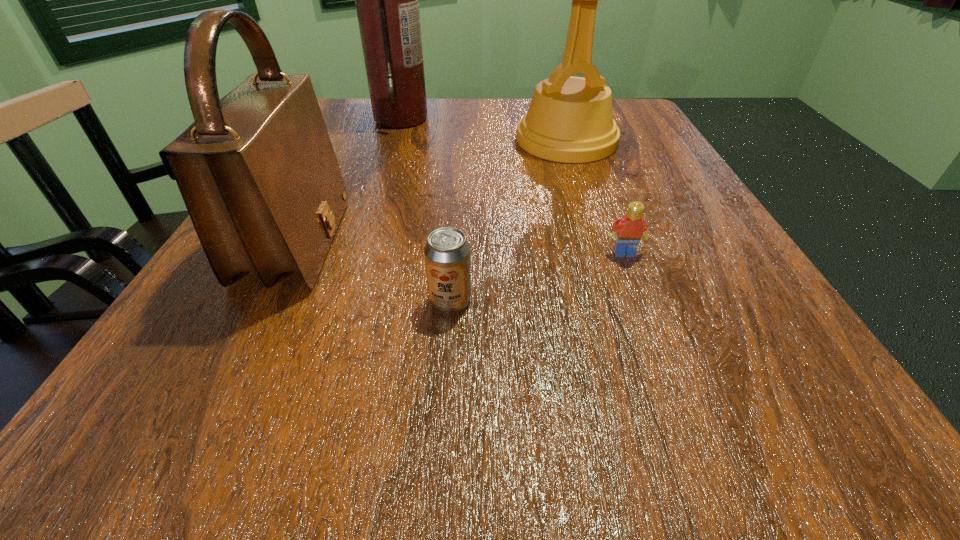
Identify the location of free space between the shortest object and the tallest object. This screenshot has width=960, height=540. (513, 185).

Locate an element on the screen. The image size is (960, 540). free space between the shortest object and the award is located at coordinates (595, 197).

Identify the location of object identified as the third closest to the award. The image size is (960, 540). (257, 171).

At what (x,y) coordinates should I click in order to perform the action: click on object identified as the fourth closest to the tallest object. Please return your answer as a coordinate pair (x, y). Looking at the image, I should click on (630, 228).

Locate an element on the screen. The image size is (960, 540). vacant region that satisfies the following two spatial constraints: 1. on the front-facing side of the fire extinguisher; 2. on the right side of the award is located at coordinates (394, 140).

Image resolution: width=960 pixels, height=540 pixels. I want to click on vacant region that satisfies the following two spatial constraints: 1. on the back side of the award; 2. on the front-facing side of the fire extinguisher, so click(x=559, y=118).